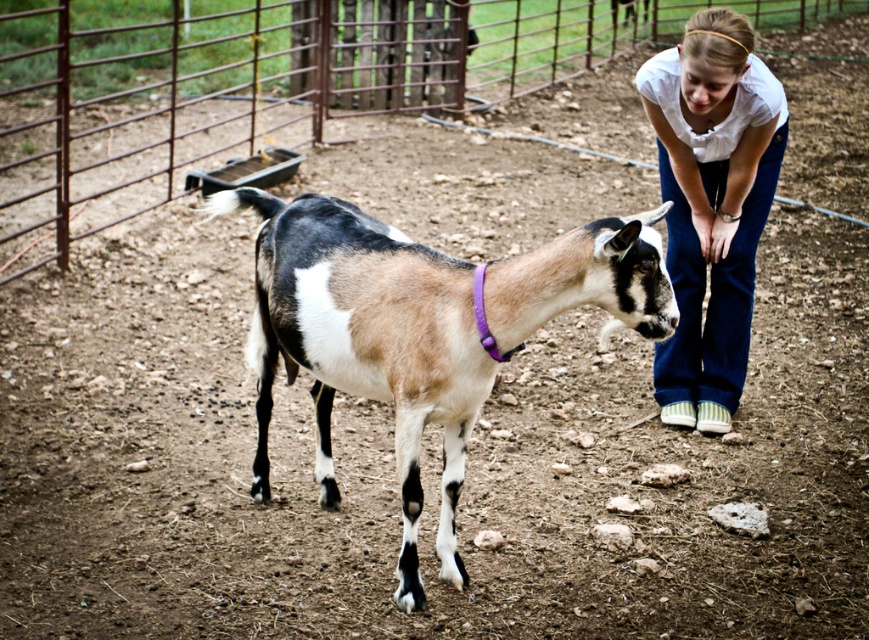
Who is more distant from viewer, (151, 120) or (708, 173)?

The point (151, 120) is more distant.

Locate an element on the screen. The image size is (869, 640). brushed metal fence at center is located at coordinates (254, 83).

Which is in front, point (596, 298) or point (747, 264)?

Positioned in front is point (596, 298).

Is point (357, 369) positioned after point (745, 280)?

No, (357, 369) is closer to viewer.

In order to click on spotted fur goat at center in this screenshot , I will do `click(420, 330)`.

Does point (177, 99) come farther from viewer compared to point (297, 296)?

Yes, point (177, 99) is behind point (297, 296).

Locate an element on the screen. This screenshot has height=640, width=869. brushed metal fence at center is located at coordinates (254, 83).

Is point (471, 93) behind point (651, 250)?

Yes.

Locate an element on the screen. brushed metal fence at center is located at coordinates (254, 83).